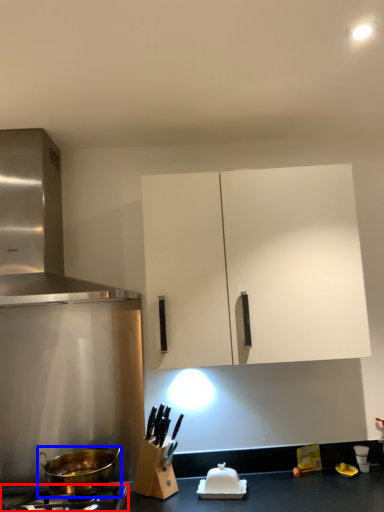
Question: Among these objects, which one is farthest to the camera, gas stove (highlighted by a red box) or wok (highlighted by a blue box)?

Choices:
 (A) gas stove
 (B) wok

Answer: (B)